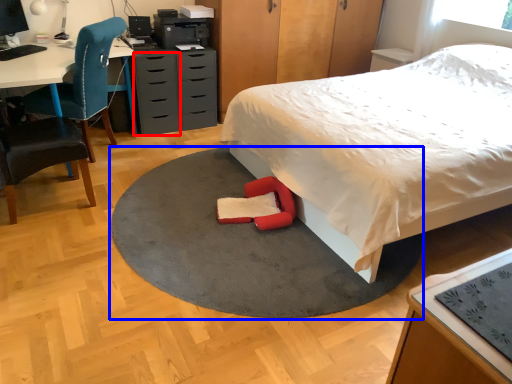
Question: Among these objects, which one is farthest to the camera, drawer (highlighted by a red box) or mat (highlighted by a blue box)?

Choices:
 (A) drawer
 (B) mat

Answer: (A)